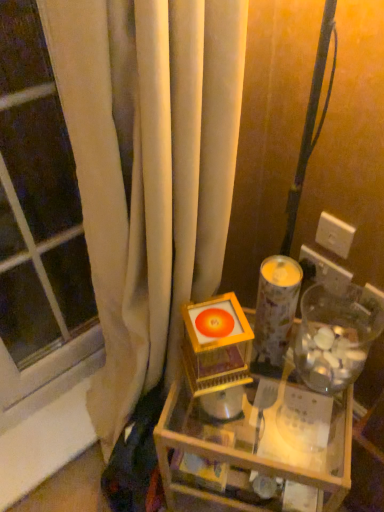
Question: Which is correct: patterned paper candle holder at center is inside wooden table at center, or outside of it?

Choices:
 (A) inside
 (B) outside

Answer: (B)

Question: Looking at their shapes, would you say patterned paper candle holder at center is wider or thinner than wooden table at center?

Choices:
 (A) wide
 (B) thin

Answer: (B)

Question: Estimate the real-world distances between objects in this image. Which object is closer to the transparent glass window at left?

Choices:
 (A) wooden table at center
 (B) orange glossy disc at center
 (C) white plastic electric outlet at upper right, the first electric outlet in the bottom-to-top sequence
 (D) white plastic electric outlet at upper right, placed as the 2th electric outlet when sorted from bottom to top
 (E) transparent plastic jar at right

Answer: (B)

Question: Based on their relative distances, which object is farther from the orange glossy disc at center?

Choices:
 (A) transparent glass window at left
 (B) white plastic electric outlet at upper right, the first electric outlet in the bottom-to-top sequence
 (C) wooden table at center
 (D) patterned paper candle holder at center
 (E) transparent plastic jar at right

Answer: (A)